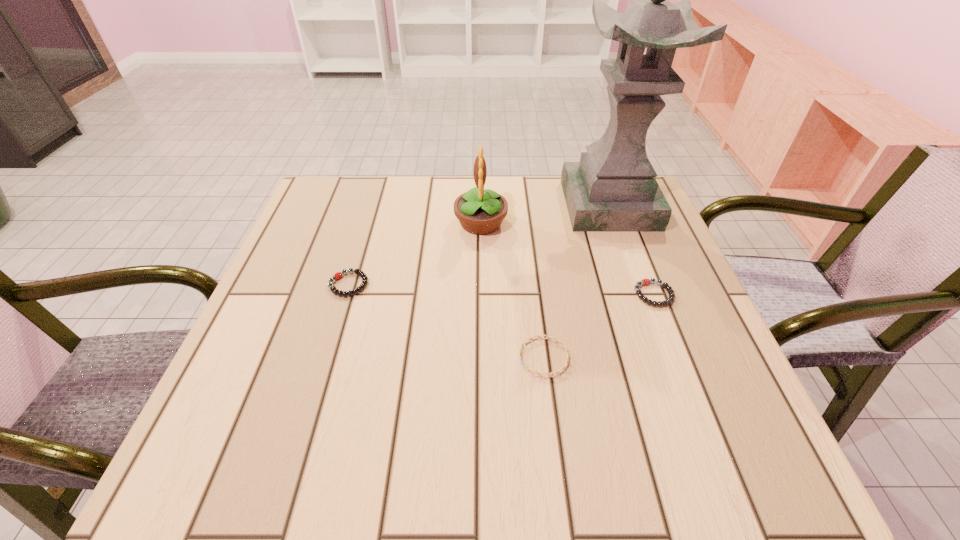
Where is `unoccupied position between the second bracelet from right to left and the sunflower`? unoccupied position between the second bracelet from right to left and the sunflower is located at coordinates (513, 290).

Identify the location of empty space between the leftmost bracelet and the tallest object. (479, 245).

Locate an element on the screen. free space between the sunflower and the second bracelet from left to right is located at coordinates (513, 290).

Where is `unoccupied position between the leftmost object and the tallest object`? unoccupied position between the leftmost object and the tallest object is located at coordinates (479, 245).

Find the location of a particular element. The image size is (960, 540). free space between the tallest object and the sunflower is located at coordinates (545, 214).

Identify the location of vacant area that lies between the tallest object and the nearest bracelet. (577, 281).

I want to click on free space between the sculpture and the sunflower, so click(545, 214).

Locate an element on the screen. Image resolution: width=960 pixels, height=540 pixels. free spot between the second bracelet from right to left and the leftmost object is located at coordinates (446, 321).

This screenshot has width=960, height=540. Identify the location of object that is the second closest one to the tallest object. (645, 281).

Select which object appears as the third closest to the leftmost object. Please provide its 2D coordinates. Your answer should be formatted as a tuple, i.e. [(x, y)], where the tuple contains the x and y coordinates of a point satisfying the conditions above.

[(613, 188)]